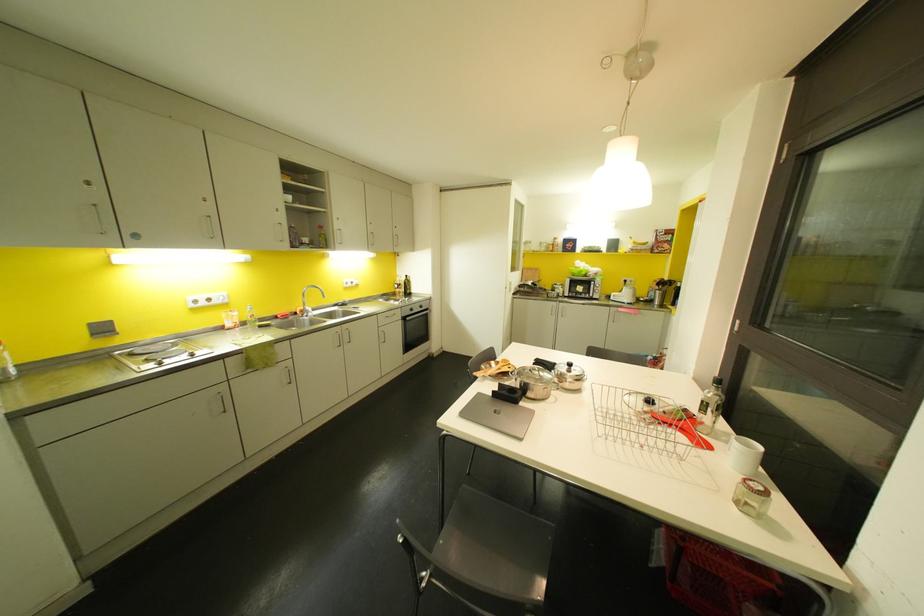
The image size is (924, 616). What do you see at coordinates (736, 325) in the screenshot? I see `the window handle` at bounding box center [736, 325].